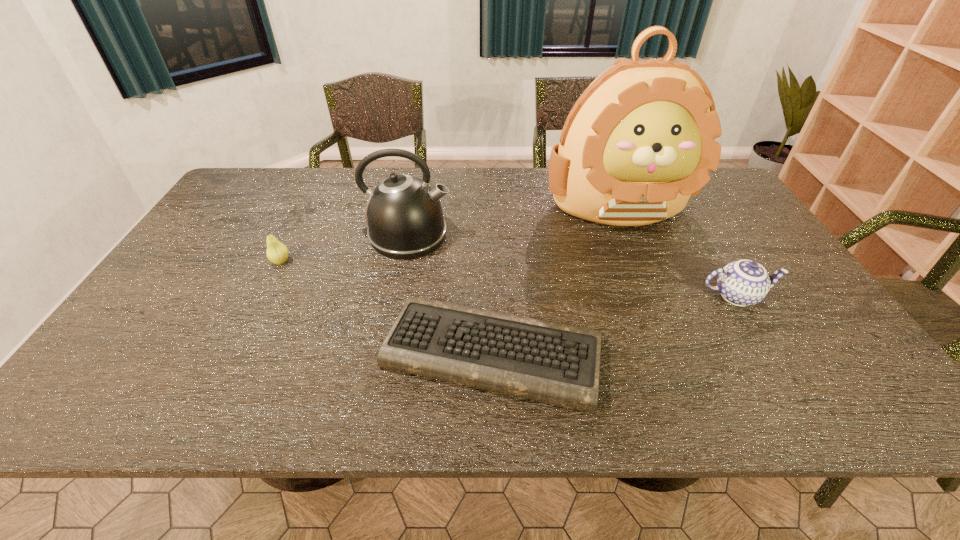
You are a GUI agent. You are given a task and a screenshot of the screen. Output one action in this format:
    pyautogui.click(x=<x>, y=<y>)
    Task: Click on the object positioned at the far edge
    
    Given the screenshot: What is the action you would take?
    pyautogui.click(x=640, y=140)

Image resolution: width=960 pixels, height=540 pixels. What are the coordinates of `object located at the near edge` in the screenshot? It's located at (559, 364).

Locate an element on the screen. This screenshot has width=960, height=540. backpack at the right edge is located at coordinates (640, 140).

Identify the location of chinaware that is at the right edge. The width and height of the screenshot is (960, 540). (742, 283).

This screenshot has height=540, width=960. What are the coordinates of `object located at the far right corner` in the screenshot? It's located at (640, 140).

In the image, there is a desktop. Identify the location of vacant space at the far edge. The image size is (960, 540). (373, 183).

In the image, there is a desktop. At what (x,y) coordinates should I click in order to perform the action: click on vacant space at the near edge. Please return your answer as a coordinate pair (x, y). Looking at the image, I should click on (226, 378).

You are a GUI agent. You are given a task and a screenshot of the screen. Output one action in this format:
    pyautogui.click(x=<x>, y=<y>)
    Task: Click on the vacant space at the left edge of the desktop
    The height and width of the screenshot is (540, 960).
    Given the screenshot: What is the action you would take?
    pyautogui.click(x=176, y=301)

The width and height of the screenshot is (960, 540). I want to click on vacant region at the far left corner of the desktop, so click(x=269, y=175).

In the image, there is a desktop. Identify the location of free space at the near left corner. [x=60, y=416].